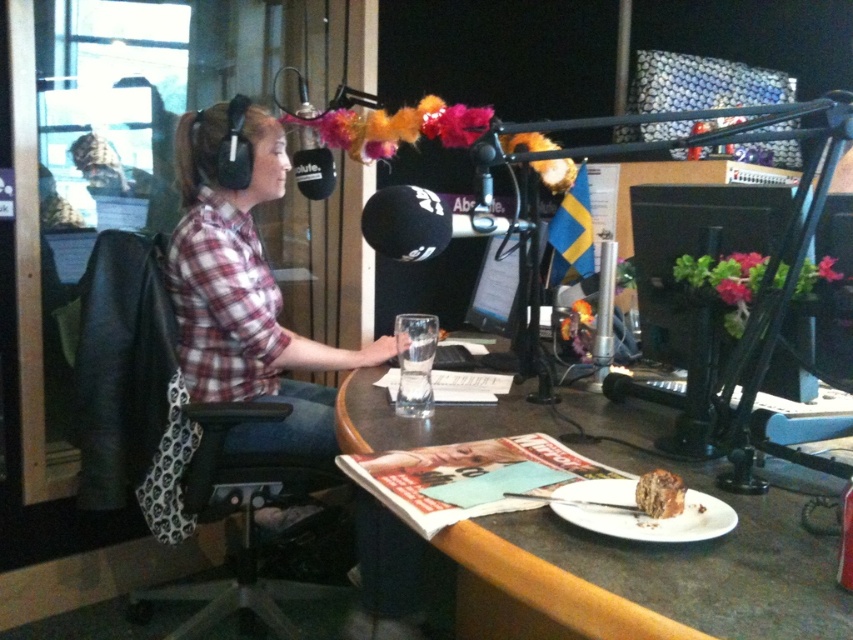
This screenshot has height=640, width=853. What do you see at coordinates (166, 433) in the screenshot?
I see `black fabric swivel chair at left` at bounding box center [166, 433].

Is point (184, 426) in front of point (666, 499)?

No, it is not.

Which is in front, point (160, 248) or point (664, 481)?

Point (664, 481)

Locate an element on the screen. The image size is (853, 640). black fabric swivel chair at left is located at coordinates (166, 433).

Who is more distant from viewer, (x=653, y=429) or (x=300, y=584)?

The point (x=300, y=584) is more distant.

Which is above, smooth brown table at center or black fabric swivel chair at left?

Positioned higher is smooth brown table at center.

Does point (824, 620) lie in front of point (134, 372)?

Yes, point (824, 620) is closer to viewer.

Identify the location of smooth brown table at center. (637, 573).

Image resolution: width=853 pixels, height=640 pixels. What do you see at coordinates (166, 433) in the screenshot?
I see `black fabric swivel chair at left` at bounding box center [166, 433].

Can you confirm if black fabric swivel chair at left is positioned below plaid shirt at center?

Yes.

Who is more distant from viewer, (263,582) or (276,282)?

Point (276,282)

Identify the location of black fabric swivel chair at left. Image resolution: width=853 pixels, height=640 pixels. [x=166, y=433].